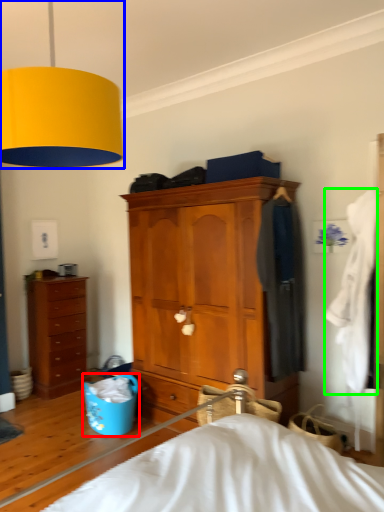
Question: Considering the real-world distances, which object is closest to laundry basket (highlighted by a red box)? lamp (highlighted by a blue box) or clothing (highlighted by a green box).

Choices:
 (A) lamp
 (B) clothing

Answer: (B)